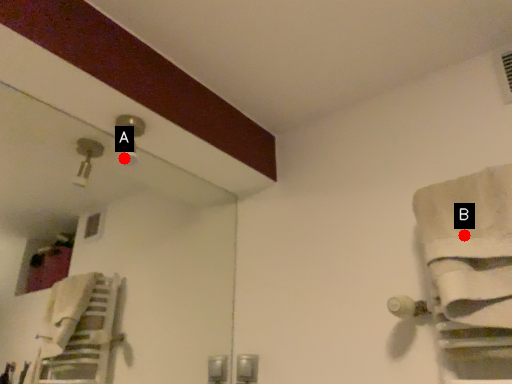
Question: Two points are circled on the image, labeled by A and B beside each circle. Which point is farther to the camera?

Choices:
 (A) A is further
 (B) B is further

Answer: (A)